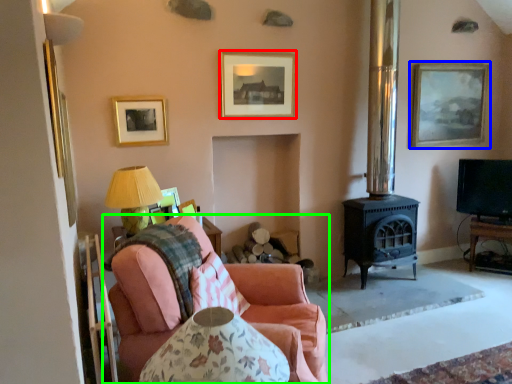
Question: Considering the real-world distances, which object is closest to picture frame (highlighted by a red box)? picture frame (highlighted by a blue box) or studio couch (highlighted by a green box).

Choices:
 (A) picture frame
 (B) studio couch

Answer: (B)